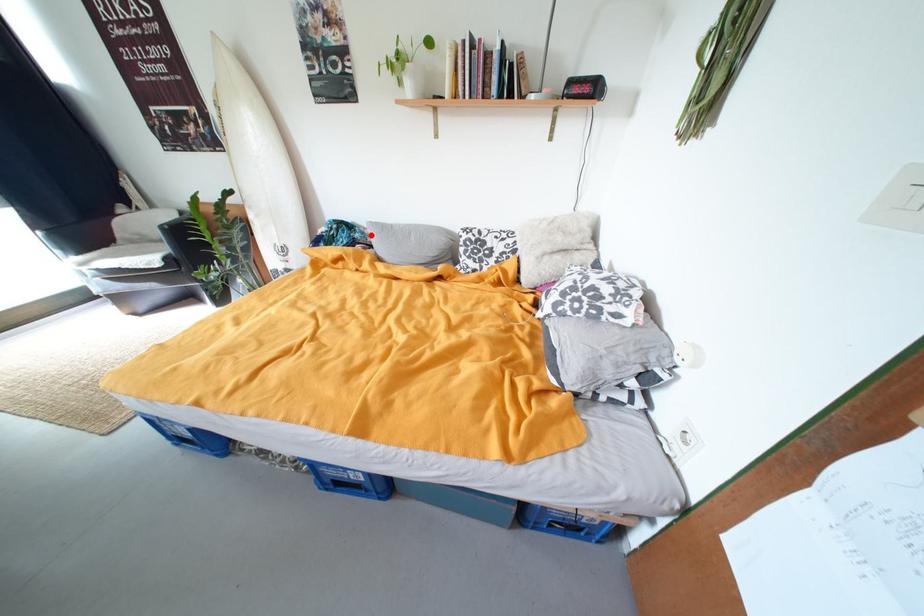
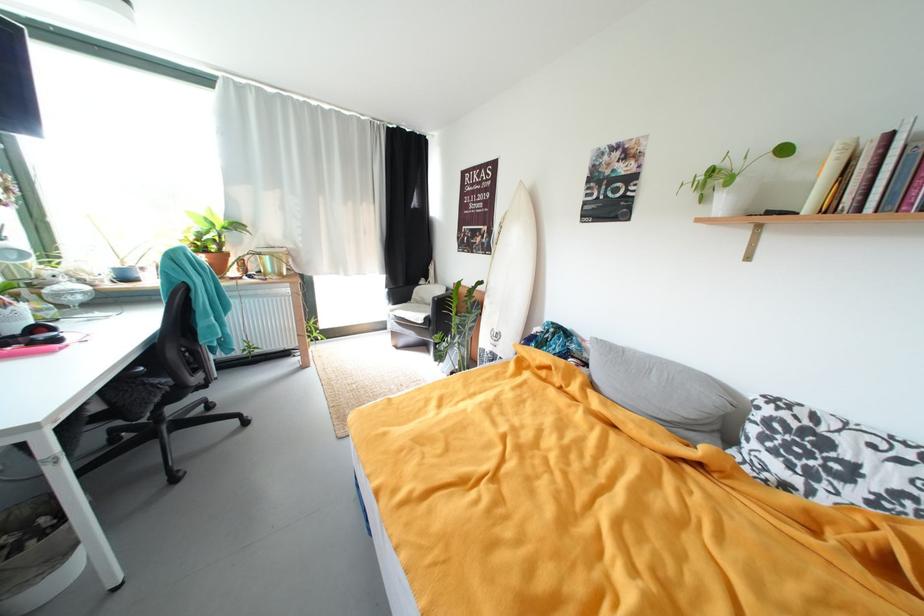
Question: I am providing you with two images of the same scene from different viewpoints. In image1, a red point is highlighted. Considering the same 3D point in image2, which of the following is correct?

Choices:
 (A) It is closer
 (B) It is farther

Answer: (B)